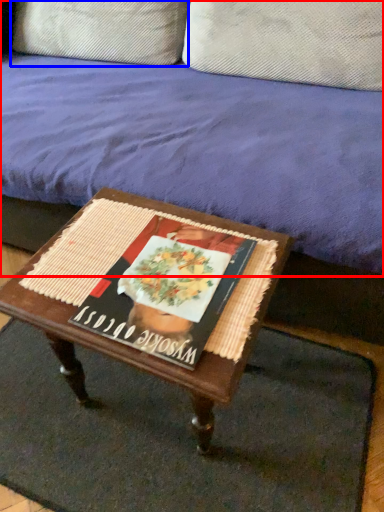
Question: Which object appears closest to the camera in this image, studio couch (highlighted by a red box) or pillow (highlighted by a blue box)?

Choices:
 (A) studio couch
 (B) pillow

Answer: (A)